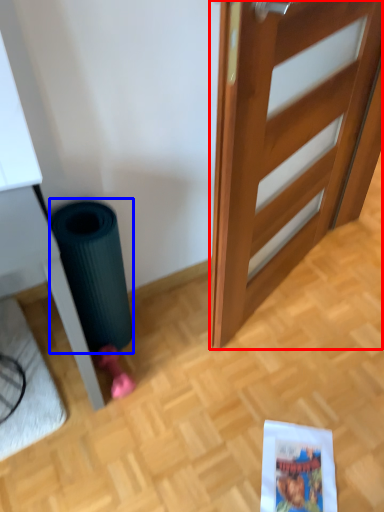
Question: Which point is closer to the camera, door (highlighted by a red box) or garbage (highlighted by a blue box)?

Choices:
 (A) door
 (B) garbage

Answer: (A)